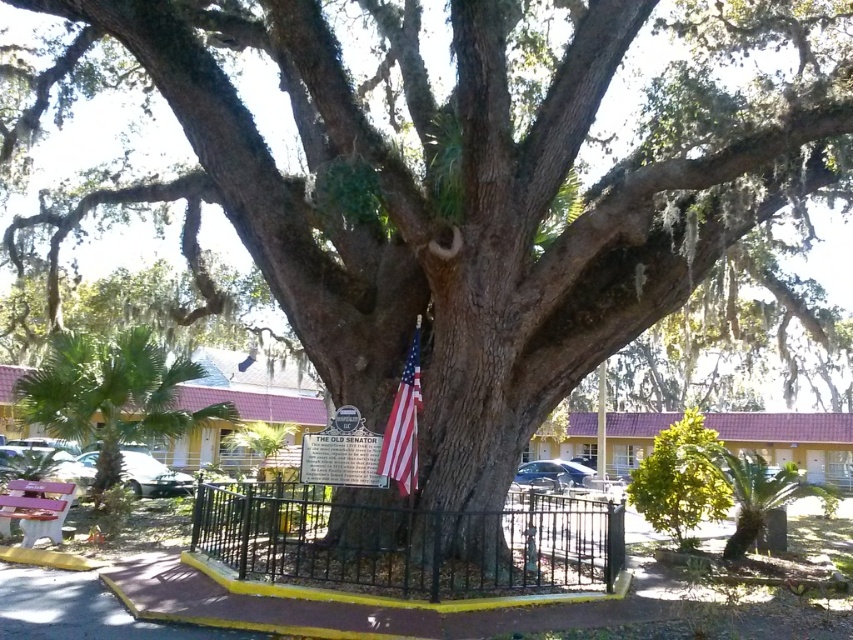
You are a gardener who needs to trim the green leafy bush at center and the black wrought iron fence at center. Which object requires you to use a taller ladder?

The green leafy bush at center requires a taller ladder because it is taller than the black wrought iron fence at center.

You are a photographer planning to take a picture of the green leafy palm at lower right and the american flag at center. You want to ensure both are fully visible in the frame. Which object should you focus on first to avoid cropping either one?

The green leafy palm at lower right is taller than the american flag at center, so you should focus on the green leafy palm at lower right first to ensure its full height is captured before adjusting the frame to include the american flag at center.

You are a visitor standing in front of the oak tree and want to sit on the matte pink wood bench at lower left. Can you walk directly to it without going around the black wrought iron fence at center?

The black wrought iron fence at center is in front of the matte pink wood bench at lower left, so you would need to go around the fence to reach the bench.